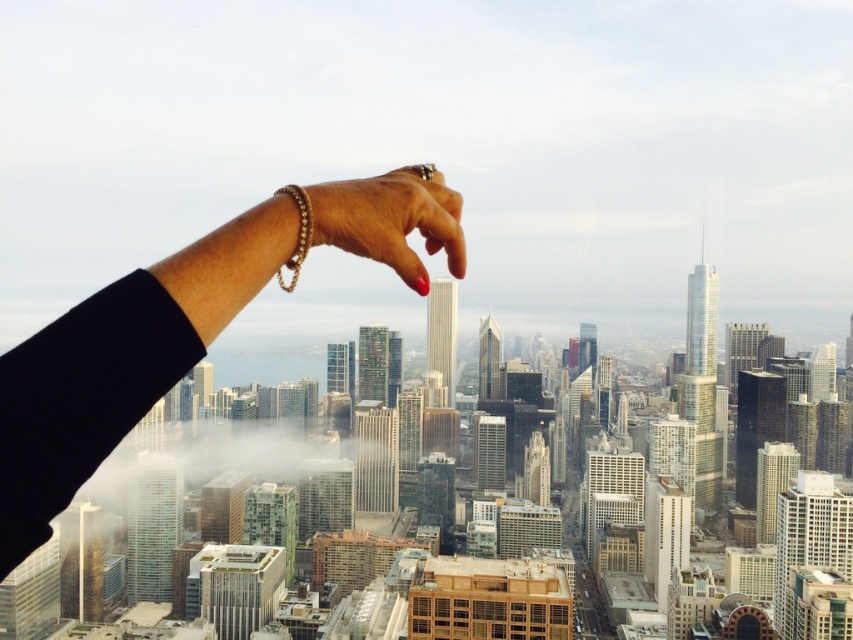
Who is more forward, (22, 474) or (354, 200)?

Positioned in front is point (22, 474).

Who is more forward, (39,449) or (370,257)?

Point (39,449) is more forward.

At what (x,y) coordinates should I click in order to perform the action: click on gold chain bracelet at upper center. Please return your answer as a coordinate pair (x, y). The image size is (853, 640). Looking at the image, I should click on (183, 330).